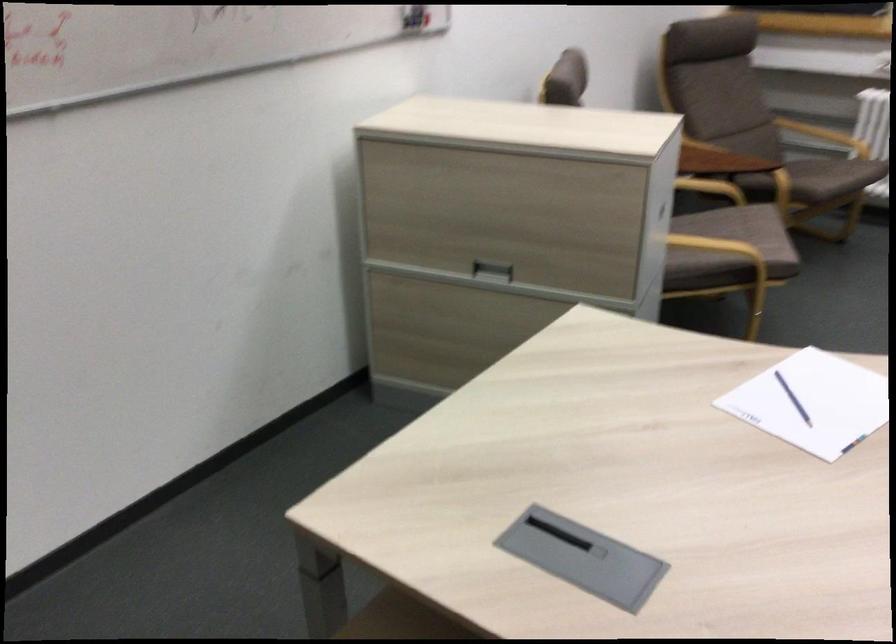
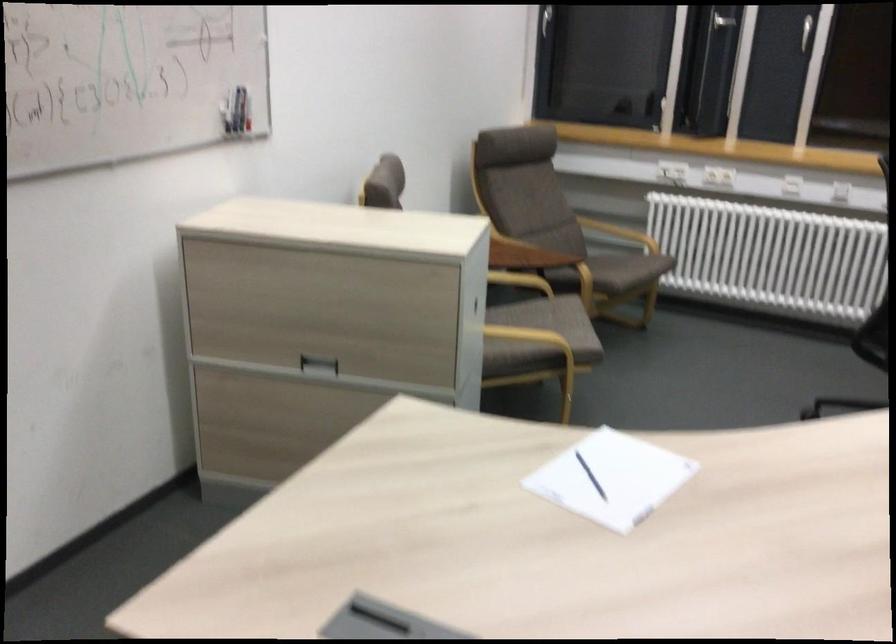
Locate, in the second image, the point that corresponds to pixel 821 176 in the first image.

(618, 270)